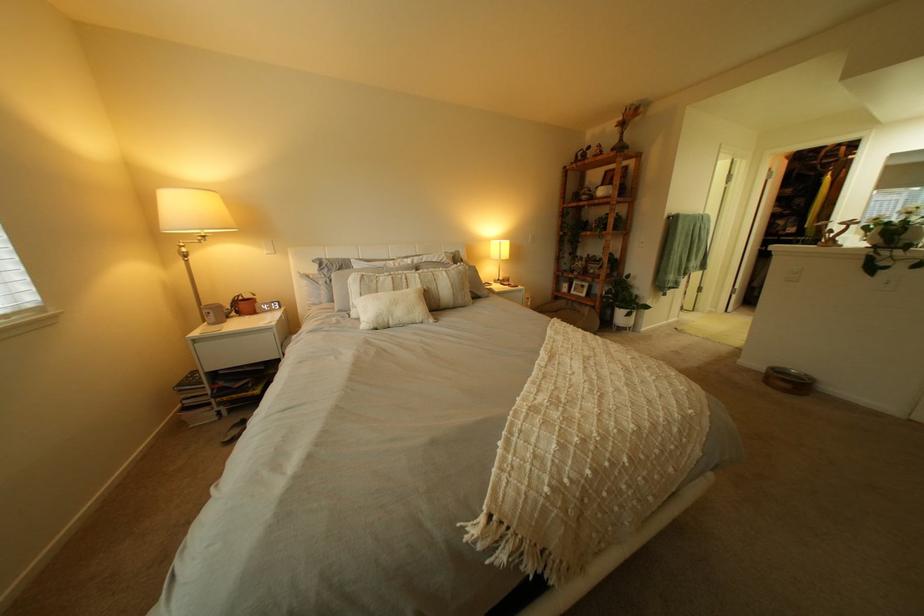
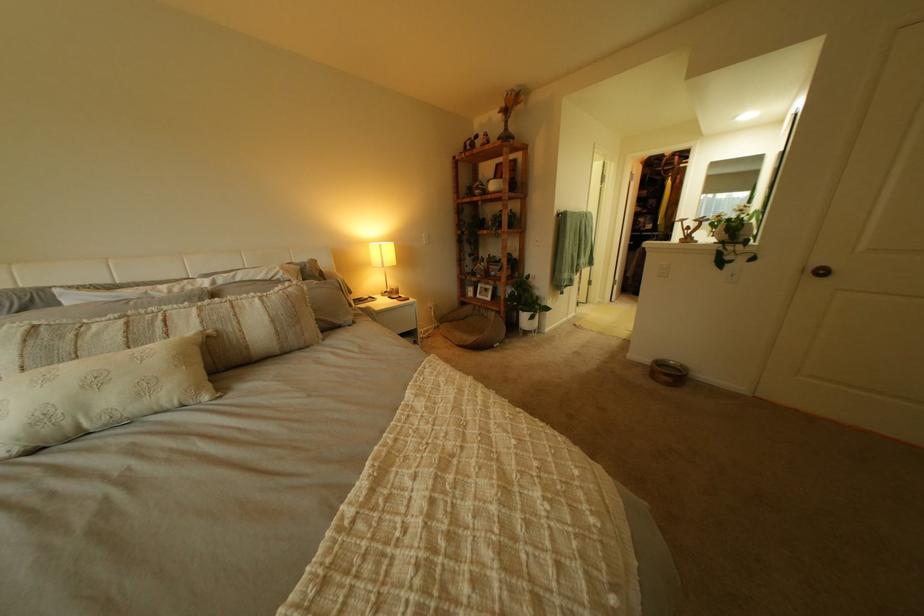
Where in the second image is the point corresponding to the point at 434,283 from the first image?

(213, 323)